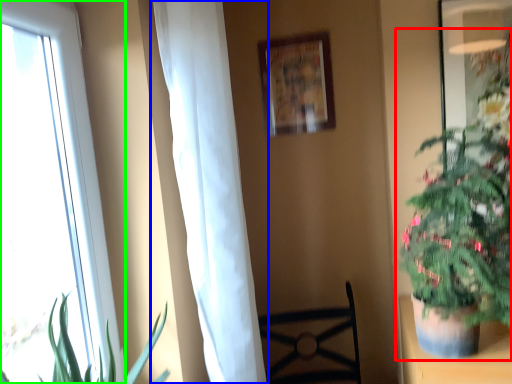
Question: Which object is the closest to the houseplant (highlighted by a red box)? Choose among these: curtain (highlighted by a blue box) or window (highlighted by a green box).

Choices:
 (A) curtain
 (B) window

Answer: (A)